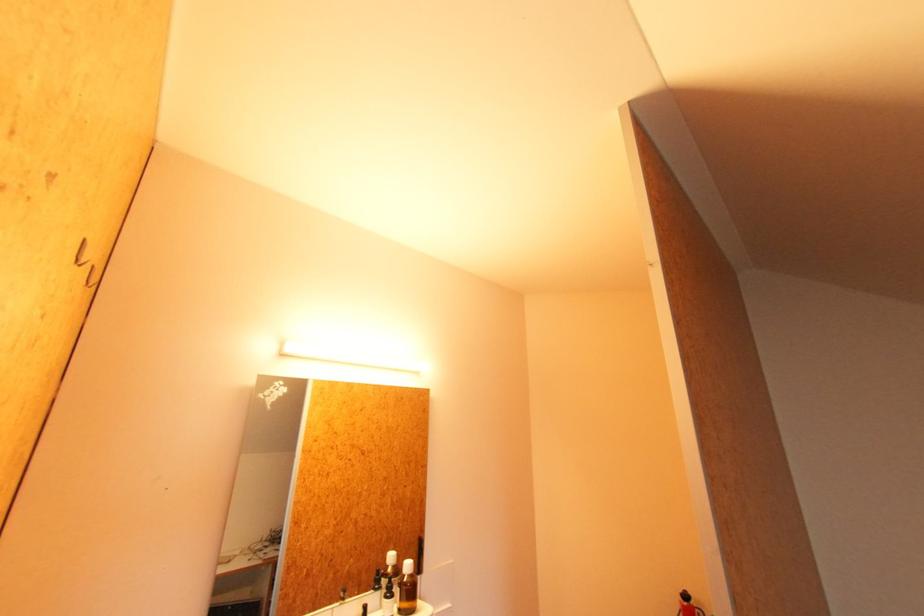
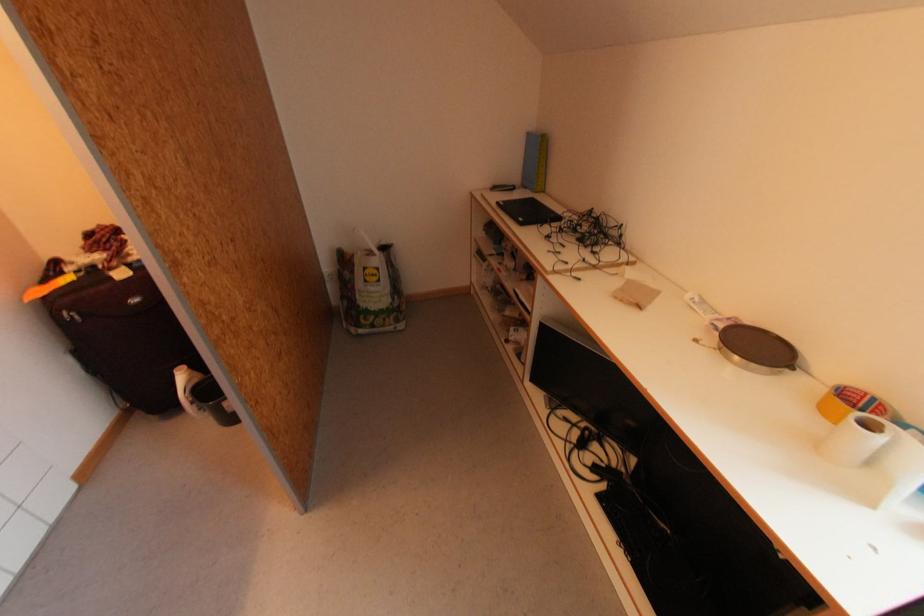
Based on the continuous images, in which direction is the camera rotating?

The camera rotated toward right-down.